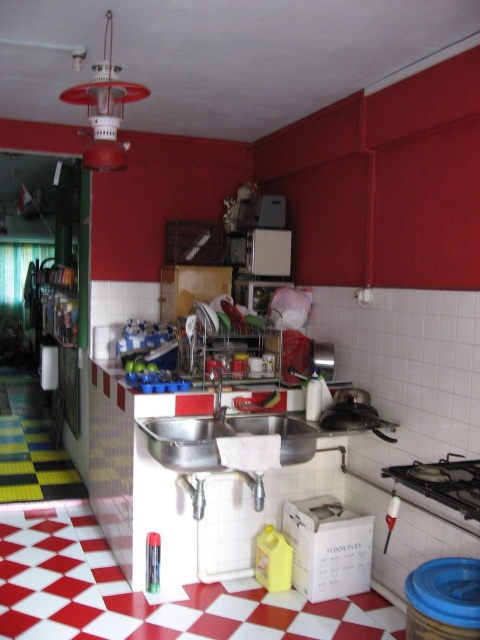
You are standing in the kitchen and need to wash dishes. Where is the stainless steel sink at center located in the image?

The stainless steel sink at center is located at point (222, 436) in the image.